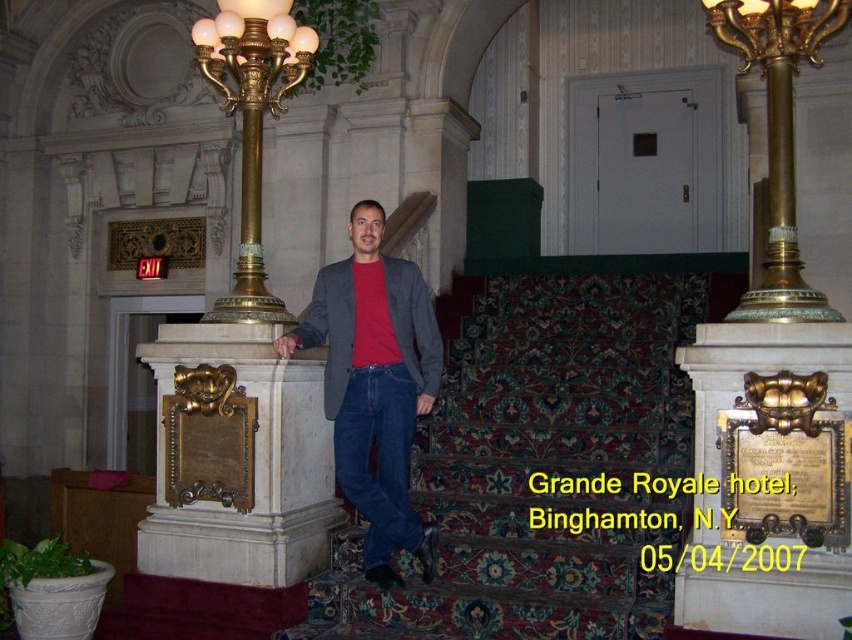
Question: Does gold polished brass at right have a smaller size compared to gold-bronze lamp post at left?

Choices:
 (A) no
 (B) yes

Answer: (B)

Question: Considering the real-world distances, which object is closest to the carpeted stairs at center?

Choices:
 (A) matte gray blazer at center
 (B) gold-bronze lamp post at left

Answer: (A)

Question: Is matte gray blazer at center in front of gold polished brass at right?

Choices:
 (A) yes
 (B) no

Answer: (B)

Question: Estimate the real-world distances between objects in this image. Which object is closer to the matte gray blazer at center?

Choices:
 (A) carpeted stairs at center
 (B) gold polished brass at right

Answer: (A)

Question: Based on their relative distances, which object is nearer to the carpeted stairs at center?

Choices:
 (A) gold-bronze lamp post at left
 (B) matte gray blazer at center

Answer: (B)

Question: Can you confirm if matte gray blazer at center is positioned to the left of gold-bronze lamp post at left?

Choices:
 (A) yes
 (B) no

Answer: (B)